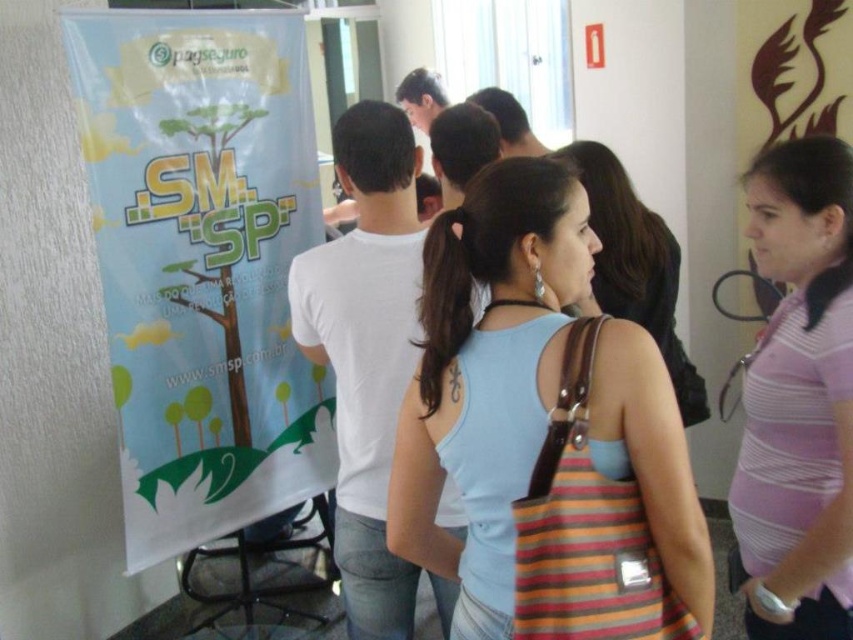
You are standing in the hallway where the event is happening. You see two points marked in the image. The first point is at coordinates point (479, 337) and the second point is at point (827, 324). Which point is closer to you?

Point (479, 337) is closer to the camera than point (827, 324).

You are at an event and see two people wearing a light blue tank top at center and a pink striped shirt at center. Which one is more to the left?

The light blue tank top at center is more to the left because it is positioned on the left side of the pink striped shirt at center.

You are at an event and see two people wearing the light blue tank top at center and the pink striped shirt at center. Which clothing item is located higher on the person?

The light blue tank top at center is located higher because it is above the pink striped shirt at center.